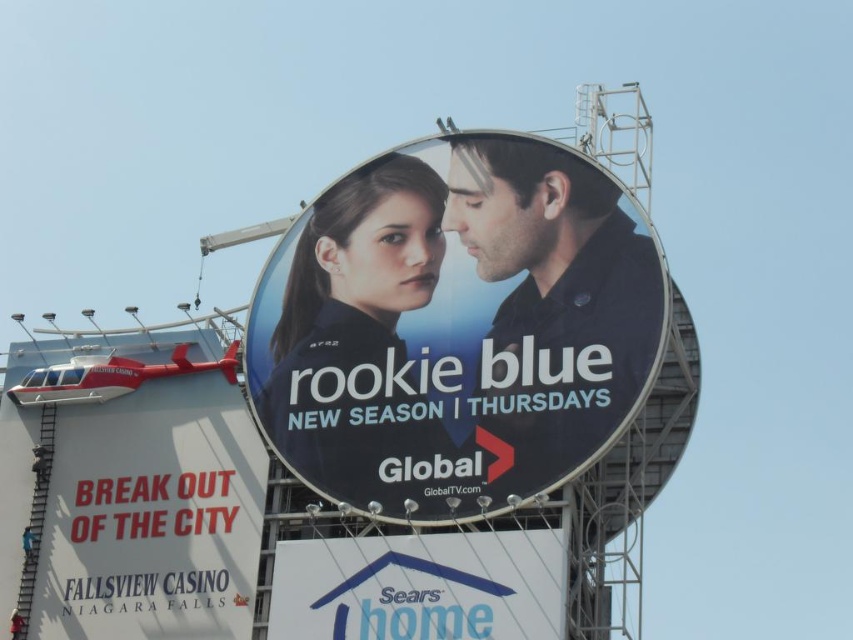
You are standing in front of the billboard and want to touch both the matte black billboard at center and the matte black shirt at center. Which object can you reach first?

The matte black billboard at center is closer to the viewer than the matte black shirt at center, so you can reach it first.

You are standing in front of the billboard for Rookie Blue. You notice the matte black billboard at center and the matte black shirt at center. Which object is located lower in the image?

The matte black billboard at center is positioned under the matte black shirt at center, so the billboard is lower than the shirt.

In the scene shown: You are standing in front of the Rookie Blue billboard and want to touch both the matte black billboard at center and the matte black shirt at center. Which object will require you to move closer to reach?

The matte black shirt at center is farther away than the matte black billboard at center by 5.36 feet, so you need to move closer to reach the matte black shirt at center.